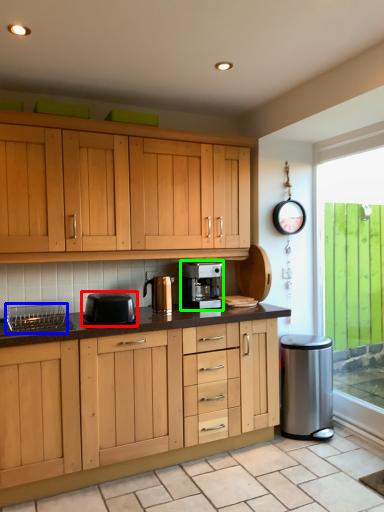
Question: Estimate the real-world distances between objects in this image. Which object is farther from kitchen appliance (highlighted by a red box), appliance (highlighted by a blue box) or home appliance (highlighted by a green box)?

Choices:
 (A) appliance
 (B) home appliance

Answer: (B)